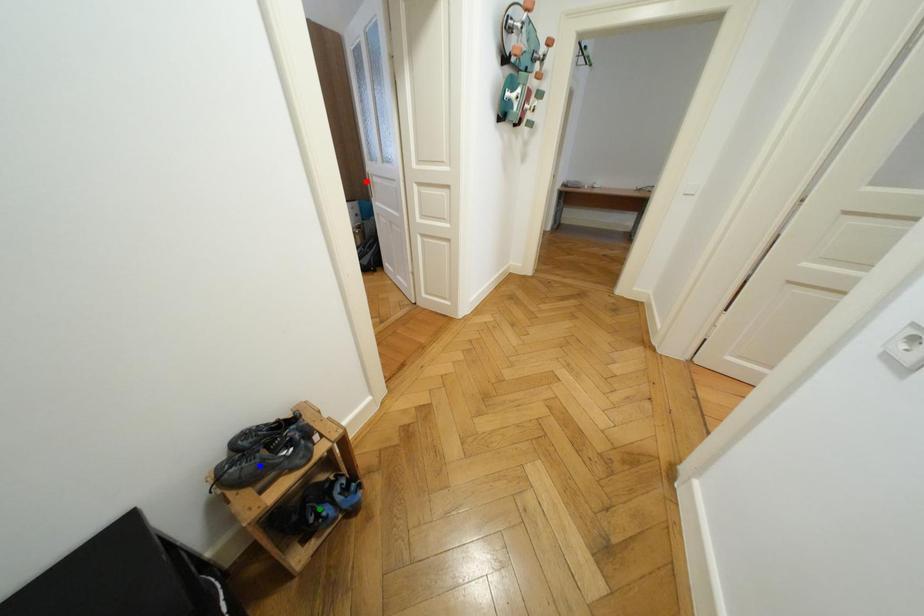
Order these from nearest to farthest:
A) red point
B) green point
C) blue point

blue point → green point → red point